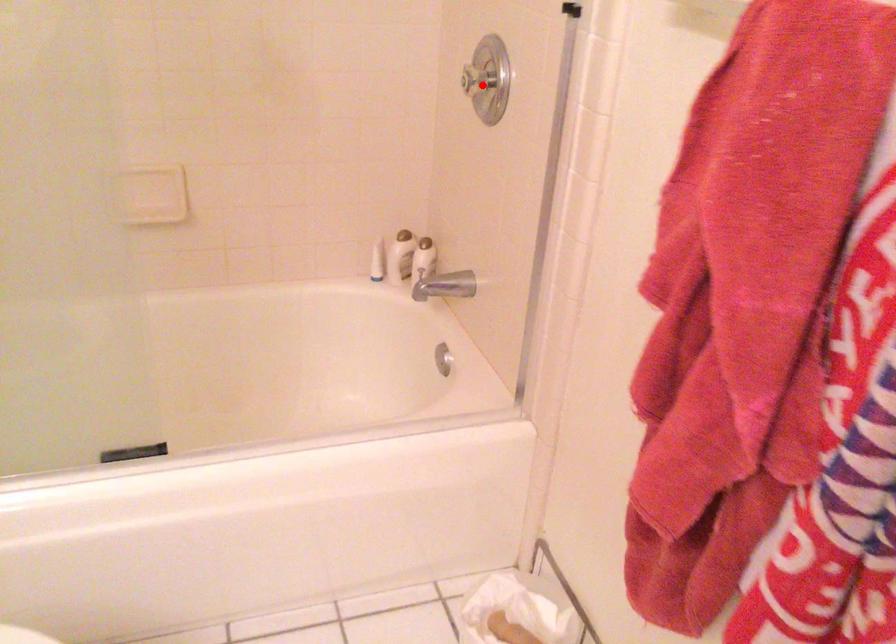
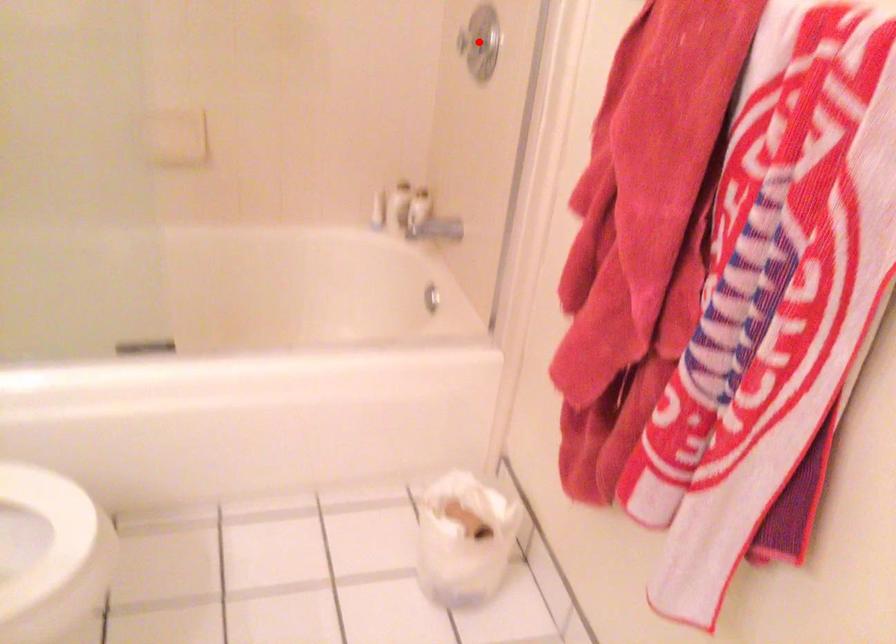
I am providing you with two images of the same scene from different viewpoints. A red point is marked on the first image and another point is marked on the second image. Are the points marked in image1 and image2 representing the same 3D position?

Yes